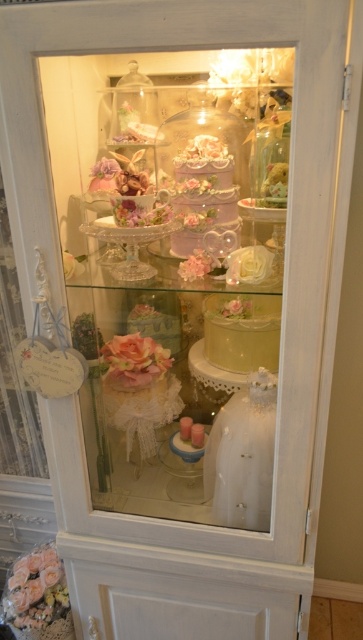
Question: Which object appears closest to the camera in this image?

Choices:
 (A) pastel pink fondant cake at center
 (B) matte pink cake at center

Answer: (A)

Question: Does pastel pink fondant cake at center have a larger size compared to matte pink cake at center?

Choices:
 (A) no
 (B) yes

Answer: (A)

Question: Can you confirm if pastel pink fondant cake at center is positioned to the right of matte pink cake at center?

Choices:
 (A) yes
 (B) no

Answer: (B)

Question: Is pastel pink fondant cake at center wider than matte pink cake at center?

Choices:
 (A) no
 (B) yes

Answer: (A)